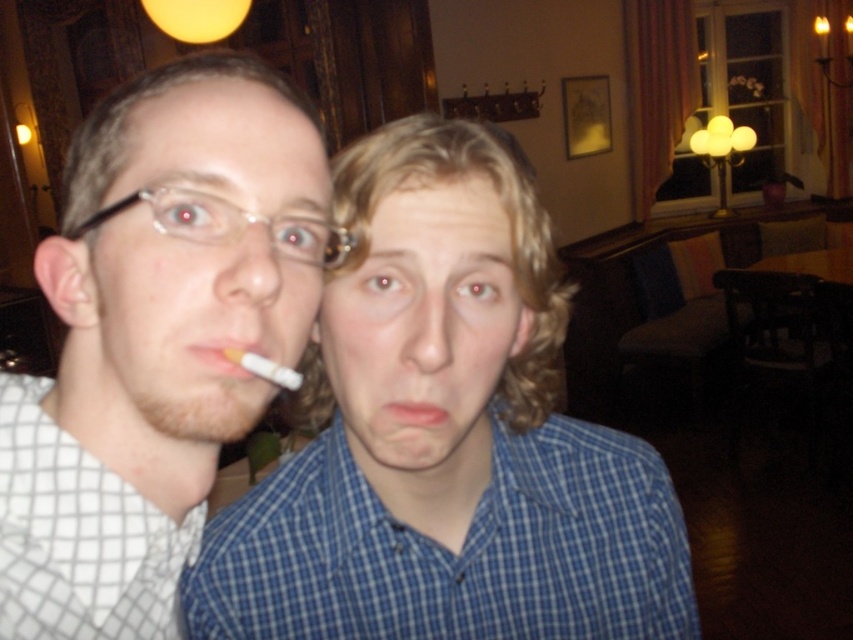
You are a photographer trying to capture a closeup of the yellow matte cigarette at center and the pink matte lips at center in the scene. Which object should you focus on first if you want to ensure both are in sharp focus?

The yellow matte cigarette at center is in front of the pink matte lips at center, so you should focus on the yellow matte cigarette at center first to ensure both are in sharp focus.

You are taking a photo of two people in a room. You notice two points in the image at coordinates point (202, 225) and point (245, 353). Which point is closer to the camera?

Point (202, 225) is closer to the camera than point (245, 353).

You are a photographer who needs to adjust the lighting in the room to ensure the yellow matte cigarette at center is well lit. Given the lamp with multiple bulbs is near the window, which direction should you move the lamp to better illuminate the cigarette?

The yellow matte cigarette at center is located at point (227, 355). To better illuminate it, move the lamp with multiple bulbs closer to the cigarette in the direction of its coordinates.